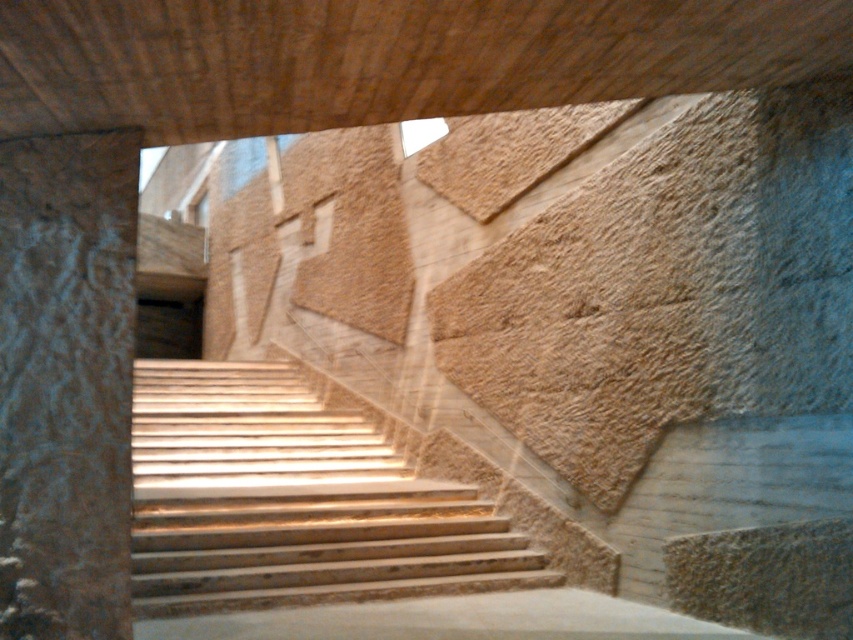
You are an interior designer assessing the space. You need to place a tall floor lamp between the light brown wooden stairs at center and the rough stone pillar at left. Which object should the lamp be placed closer to if it needs to avoid blocking the view of the taller object?

The lamp should be placed closer to the light brown wooden stairs at center since the rough stone pillar at left is taller, and positioning the lamp near the shorter stairs will prevent it from obstructing the view of the taller pillar.

You are standing at the bottom of the light brown wooden stairs at center and want to reach the rough stone pillar at left. Which direction should you move to get closer to the pillar?

To reach the rough stone pillar at left from the light brown wooden stairs at center, you should move towards the left since the stairs are located below the pillar.

Based on the photo, you are standing at the entrance of this modern space and want to reach the upper floor. The light brown wooden stairs at center are your only path. However, there is a rough stone pillar at left nearby. Can you walk around the pillar to reach the stairs?

The rough stone pillar at left is behind the light brown wooden stairs at center, so you can approach the stairs directly without needing to go around the pillar since the pillar is positioned behind them.